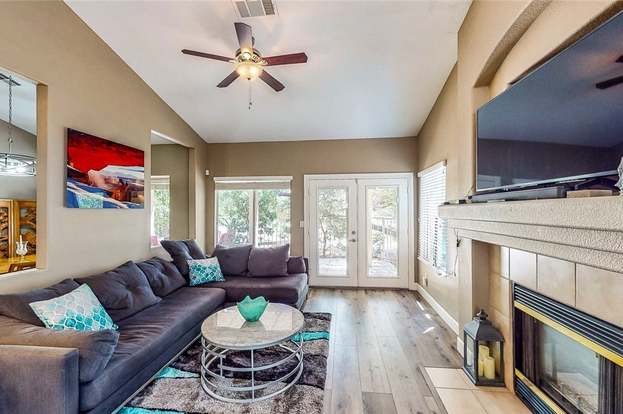
At what (x,y) coordinates should I click in order to perform the action: click on coffee table. Please return your answer as a coordinate pair (x, y). This screenshot has width=623, height=414. Looking at the image, I should click on (290, 327).